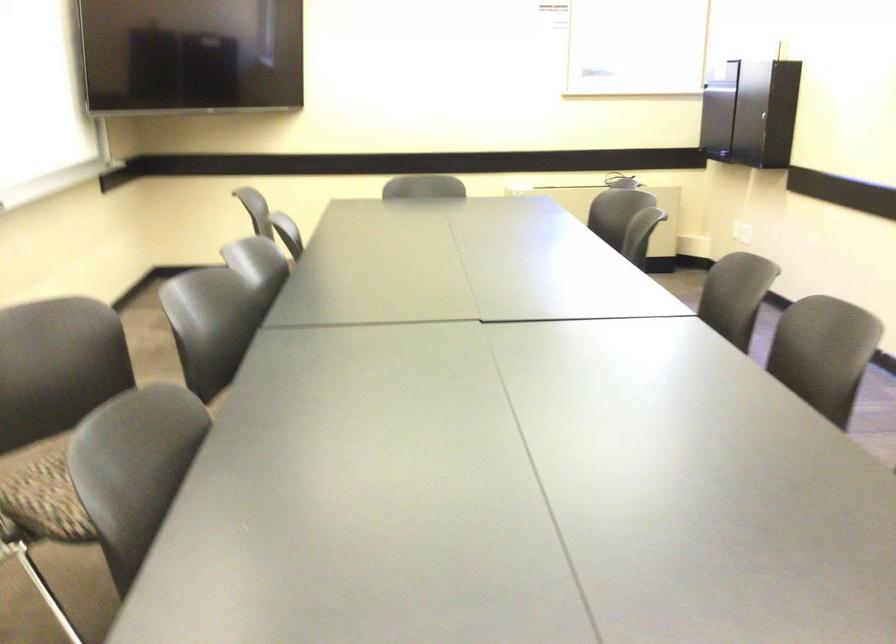
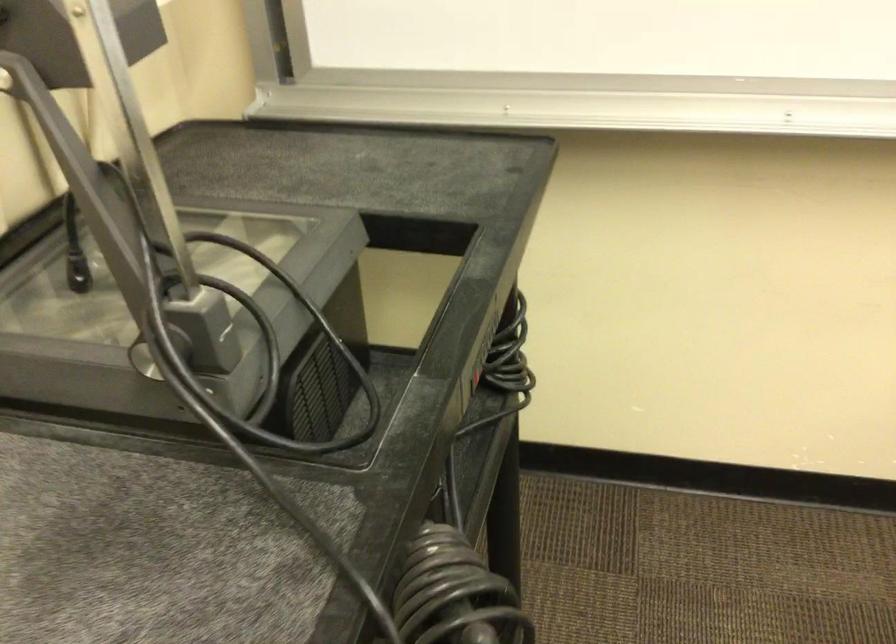
How did the camera likely rotate?

The camera rotated toward left-down.